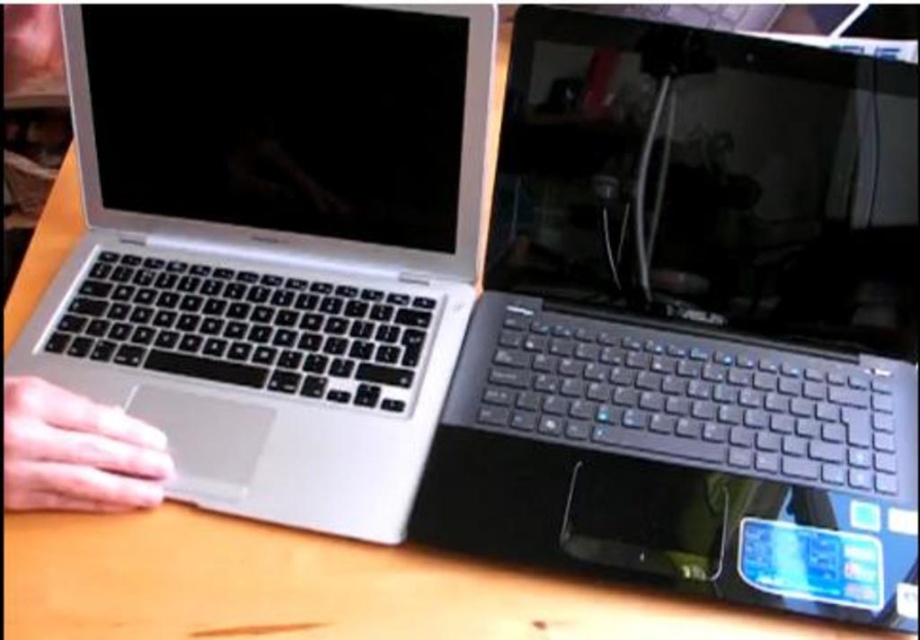
You are organizing a presentation and need to ensure your laptop is accessible. You see the sleek silver laptop at left and the skinny white hand at lower left. Which object is closer to you, the viewer?

The sleek silver laptop at left is positioned over the skinny white hand at lower left, meaning the laptop is closer to the viewer.

You are organizing a tech event and need to place a satin black laptop at center and a skinny white hand at lower left on a table. If the table has limited space, which object requires more horizontal space?

The satin black laptop at center requires more horizontal space because its width surpasses that of the skinny white hand at lower left.